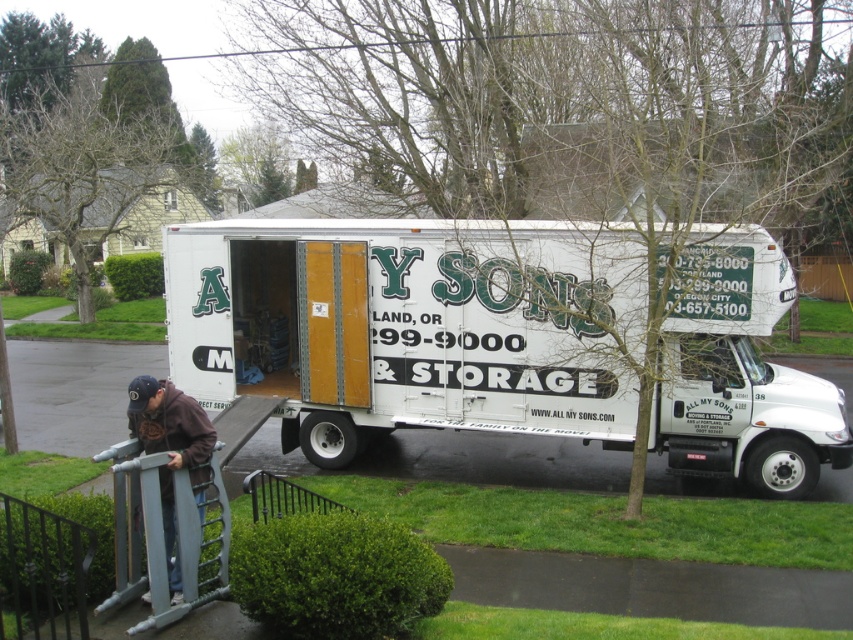
Question: In this image, where is brown hoodie at lower left located relative to black metal/rail at lower center?

Choices:
 (A) right
 (B) left

Answer: (B)

Question: Can you confirm if white matte truck at center is positioned to the right of black metal/rail at lower center?

Choices:
 (A) yes
 (B) no

Answer: (B)

Question: Which of the following is the closest to the observer?

Choices:
 (A) white matte truck at center
 (B) brown hoodie at lower left

Answer: (B)

Question: Which point appears farthest from the camera in this image?

Choices:
 (A) (173, 394)
 (B) (253, 512)
 (C) (782, 461)

Answer: (C)

Question: Does white matte truck at center have a lesser width compared to black metal/rail at lower center?

Choices:
 (A) yes
 (B) no

Answer: (A)

Question: Among these points, which one is farthest from the camera?

Choices:
 (A) (323, 442)
 (B) (149, 413)

Answer: (A)